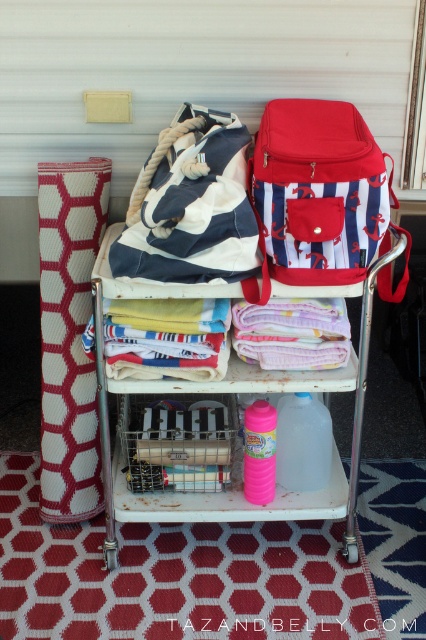
Question: Does red striped backpack at upper right have a greater width compared to white metal cart at center?

Choices:
 (A) no
 (B) yes

Answer: (A)

Question: Among these points, which one is nearest to the camera?

Choices:
 (A) [x=354, y=224]
 (B) [x=368, y=339]

Answer: (A)

Question: Does red striped backpack at upper right come in front of white metal cart at center?

Choices:
 (A) no
 (B) yes

Answer: (B)

Question: Which object appears closest to the camera in this image?

Choices:
 (A) white metal cart at center
 (B) red striped backpack at upper right

Answer: (B)

Question: Can you confirm if red striped backpack at upper right is bigger than white metal cart at center?

Choices:
 (A) yes
 (B) no

Answer: (B)